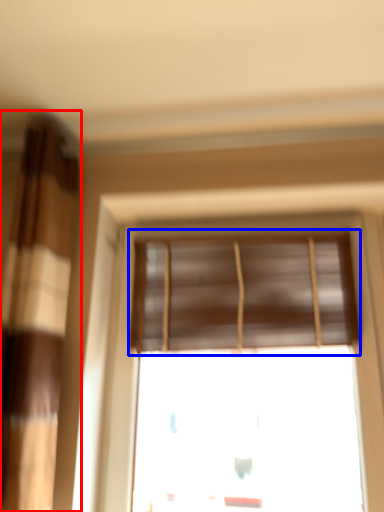
Question: Which of the following is the closest to the observer, curtain (highlighted by a red box) or window blind (highlighted by a blue box)?

Choices:
 (A) curtain
 (B) window blind

Answer: (A)